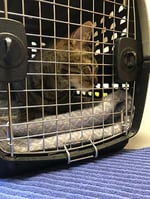
Find the location of a particular element. This screenshot has width=150, height=199. crate is located at coordinates (102, 148).